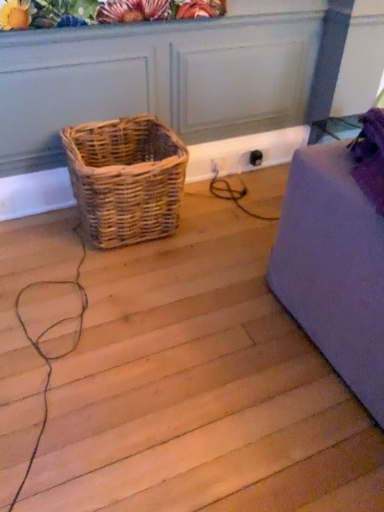
Locate an element on the screen. The height and width of the screenshot is (512, 384). free space in front of woven natural basket at center-left is located at coordinates (89, 290).